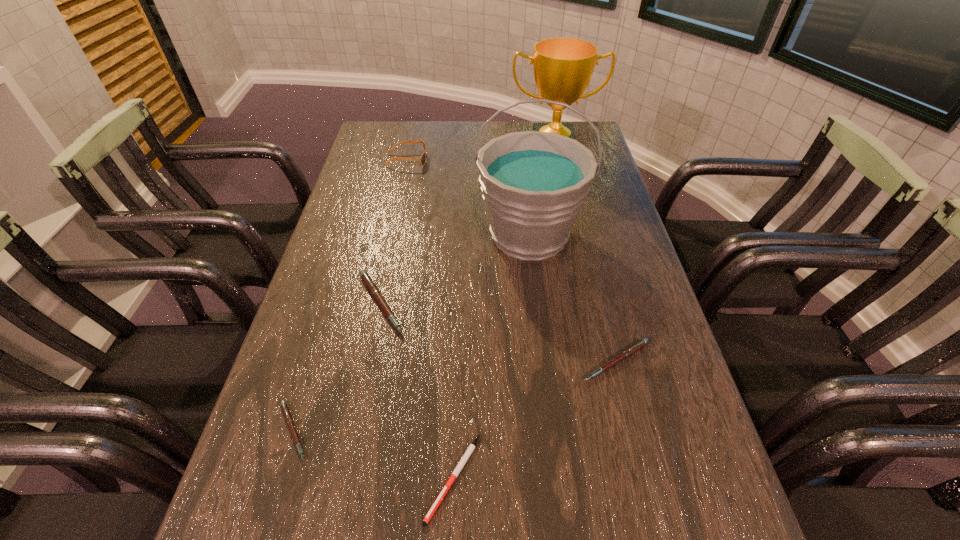
The width and height of the screenshot is (960, 540). In order to click on the third farthest object in this screenshot , I will do `click(534, 184)`.

In order to click on bucket in this screenshot , I will do `click(534, 184)`.

Where is `award`? award is located at coordinates (563, 67).

Locate an element on the screen. This screenshot has width=960, height=540. sunglasses is located at coordinates (422, 159).

Find the location of a particular element. This screenshot has width=960, height=540. the tallest pen is located at coordinates (369, 283).

Find the location of a particular element. This screenshot has width=960, height=540. the fourth tallest object is located at coordinates (369, 283).

Where is `the rightmost pink pen`? the rightmost pink pen is located at coordinates (637, 346).

At what (x,y) coordinates should I click in order to perform the action: click on the fifth farthest object. Please return your answer as a coordinate pair (x, y). The width and height of the screenshot is (960, 540). Looking at the image, I should click on (637, 346).

The height and width of the screenshot is (540, 960). Find the location of `the leftmost pen`. the leftmost pen is located at coordinates (285, 409).

Find the location of a particular element. This screenshot has height=540, width=960. the leftmost pink pen is located at coordinates (285, 409).